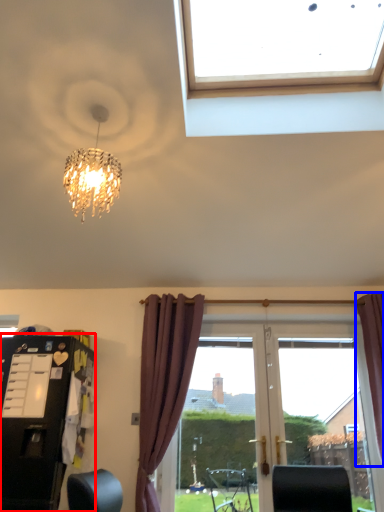
Question: Which object appears farthest to the camera in this image, dresser (highlighted by a red box) or curtain (highlighted by a blue box)?

Choices:
 (A) dresser
 (B) curtain

Answer: (B)